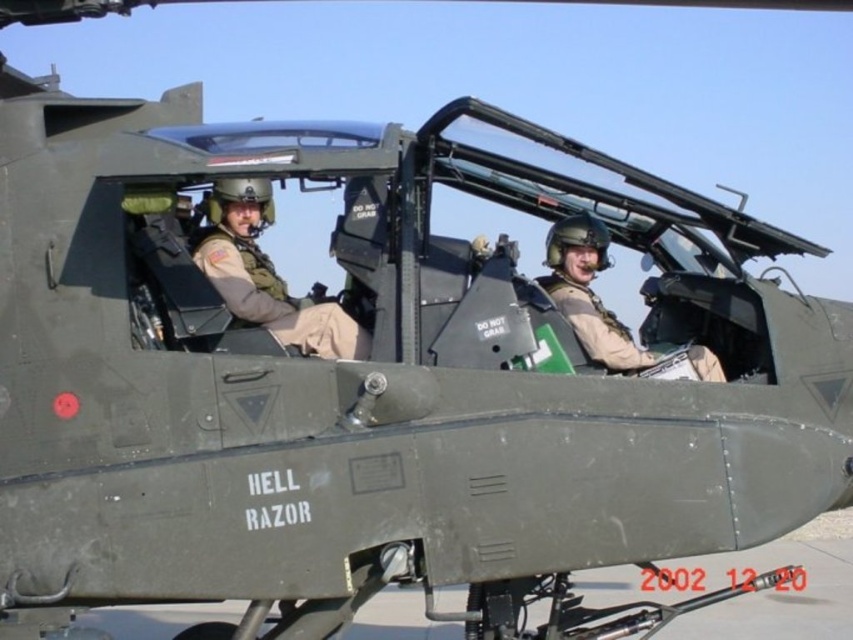
Is point (262, 218) farther from viewer compared to point (572, 214)?

No, (262, 218) is in front of (572, 214).

Which is above, matte khaki uniform at center or matte green helmet at center?

matte khaki uniform at center is higher up.

The width and height of the screenshot is (853, 640). Identify the location of matte khaki uniform at center. (267, 276).